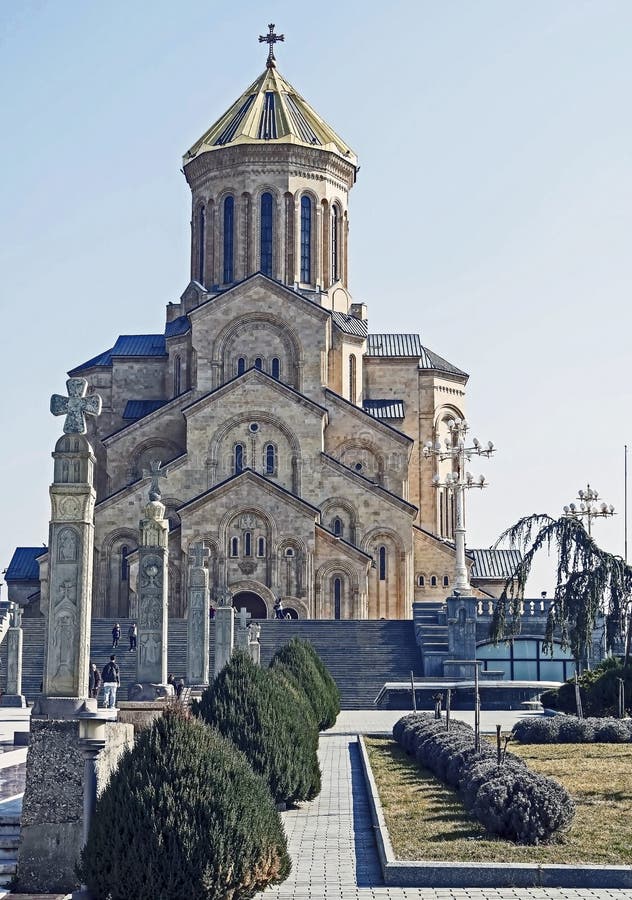
This screenshot has height=900, width=632. I want to click on tiny, narrow windows, so click(233, 549), click(244, 542), click(258, 544).